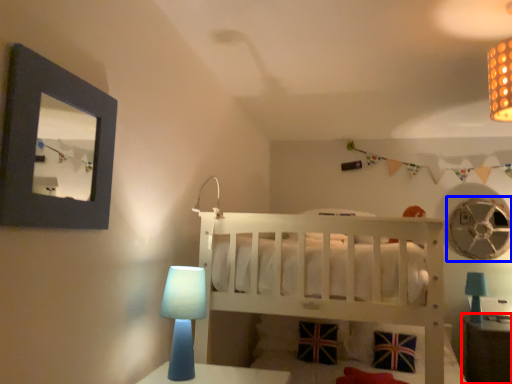
Question: Which of the following is the closest to the observer, table (highlighted by a red box) or mechanical fan (highlighted by a blue box)?

Choices:
 (A) table
 (B) mechanical fan

Answer: (A)